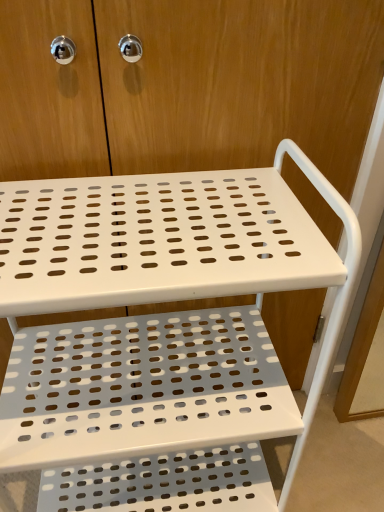
Where is `white perforated metal cart at center`? The width and height of the screenshot is (384, 512). white perforated metal cart at center is located at coordinates (160, 333).

This screenshot has height=512, width=384. What do you see at coordinates (160, 333) in the screenshot?
I see `white perforated metal cart at center` at bounding box center [160, 333].

Locate an element on the screen. white perforated metal cart at center is located at coordinates (x=160, y=333).